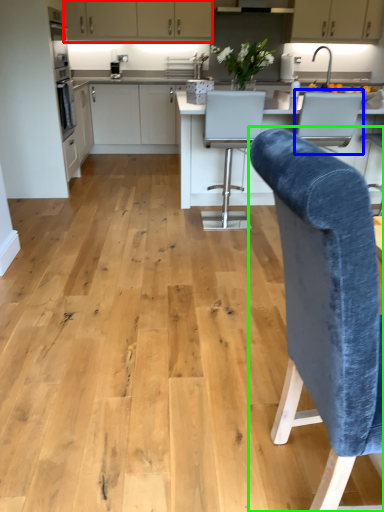
Question: Which is nearer to the cabinetry (highlighted by a red box)? armchair (highlighted by a blue box) or chair (highlighted by a green box).

Choices:
 (A) armchair
 (B) chair

Answer: (A)